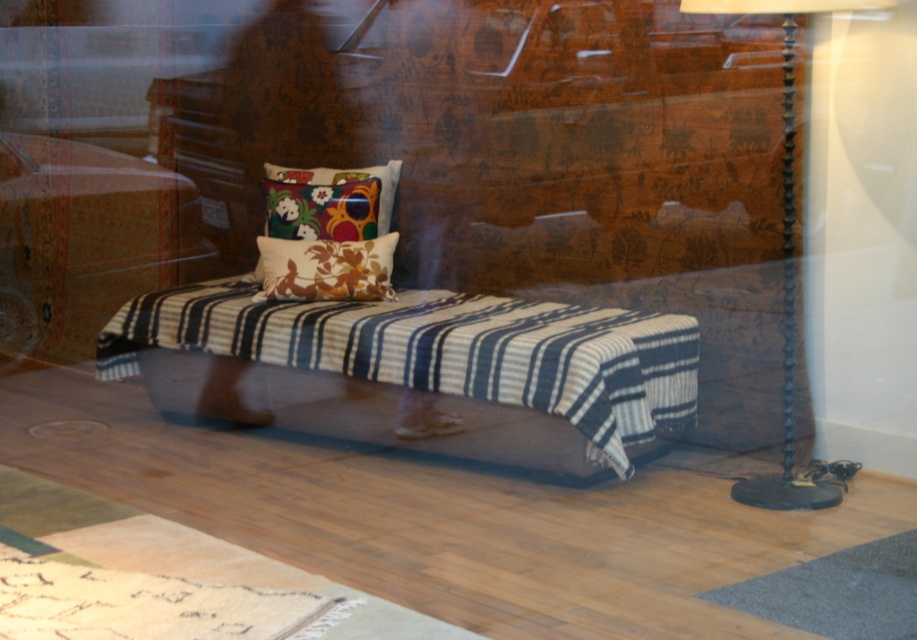
Does black metal floor lamp at right lie behind floral-patterned fabric pillow at center?

No.

Is point (791, 410) farther from viewer compared to point (264, 237)?

No, it is in front of (264, 237).

Which is in front, point (759, 483) or point (381, 236)?

Positioned in front is point (759, 483).

I want to click on black metal floor lamp at right, so coord(786,259).

Can you confirm if floral-patterned fabric pillow at center is wider than floral fabric cushion at center?

In fact, floral-patterned fabric pillow at center might be narrower than floral fabric cushion at center.

Between floral-patterned fabric pillow at center and floral fabric cushion at center, which one appears on the left side from the viewer's perspective?

Positioned to the left is floral fabric cushion at center.

What do you see at coordinates (326, 268) in the screenshot?
I see `floral-patterned fabric pillow at center` at bounding box center [326, 268].

Locate an element on the screen. This screenshot has width=917, height=640. floral-patterned fabric pillow at center is located at coordinates (x=326, y=268).

Measure the distance from striped fabric bench at center to floral-patterned fabric pillow at center.

A distance of 21.56 inches exists between striped fabric bench at center and floral-patterned fabric pillow at center.

Is striped fabric bench at center behind floral-patterned fabric pillow at center?

No.

Is point (554, 333) positioned behind point (263, 237)?

No, (554, 333) is in front of (263, 237).

Find the location of `striped fabric bench at center`. striped fabric bench at center is located at coordinates (471, 349).